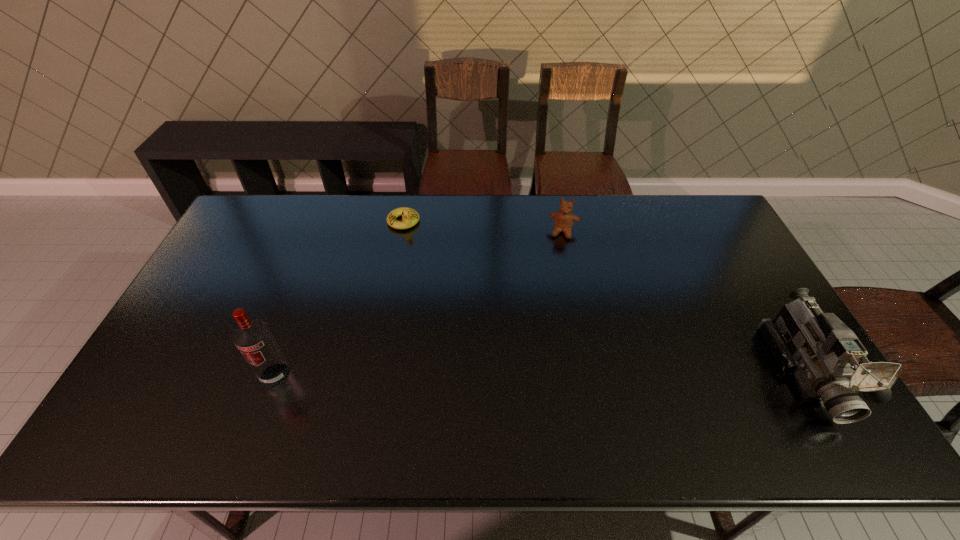
Find the location of `free space on the desktop that is between the vodka and the camcorder and is positioned on the face of the duckling`. free space on the desktop that is between the vodka and the camcorder and is positioned on the face of the duckling is located at coordinates (488, 373).

Find the location of a particular element. This screenshot has height=540, width=960. free space on the desktop that is between the tallest object and the third shortest object and is positioned on the face of the second shortest object is located at coordinates (540, 373).